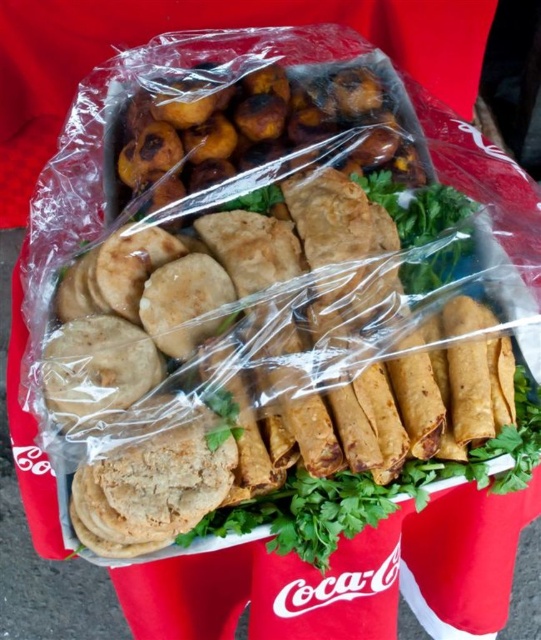
Question: Which point is closer to the camera?

Choices:
 (A) golden-brown crispy fried balls at upper center
 (B) brown crispy taquitos at center

Answer: (B)

Question: Can you confirm if brown crispy taquitos at center is thinner than golden-brown crispy fried balls at upper center?

Choices:
 (A) yes
 (B) no

Answer: (B)

Question: Does brown crispy taquitos at center have a smaller size compared to golden-brown crispy fried balls at upper center?

Choices:
 (A) no
 (B) yes

Answer: (A)

Question: Is brown crispy taquitos at center smaller than golden-brown crispy fried balls at upper center?

Choices:
 (A) yes
 (B) no

Answer: (B)

Question: Which point is farther to the camera?

Choices:
 (A) brown crispy taquitos at center
 (B) golden-brown crispy fried balls at upper center

Answer: (B)

Question: Which object is closer to the camera taking this photo?

Choices:
 (A) golden-brown crispy fried balls at upper center
 (B) brown crispy taquitos at center

Answer: (B)